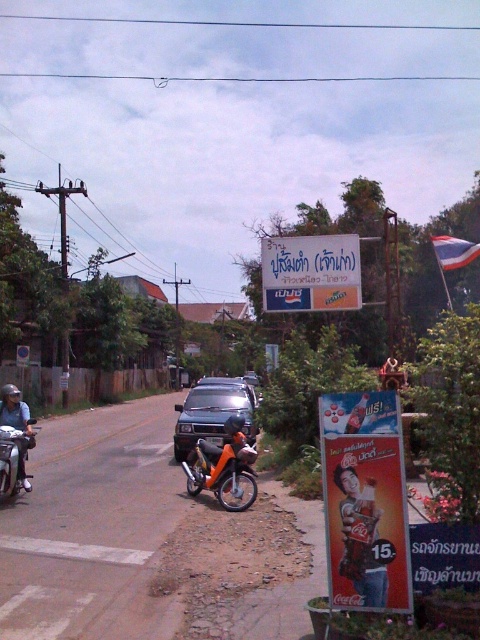
Between smooth plastic coca-cola sign at lower right and orange matte motorcycle at center, which one is positioned higher?

smooth plastic coca-cola sign at lower right is above.

Is smooth plastic coca-cola sign at lower right in front of orange matte motorcycle at center?

Yes, it is.

Who is more forward, (x=369, y=582) or (x=236, y=435)?

Point (x=369, y=582) is more forward.

Image resolution: width=480 pixels, height=640 pixels. I want to click on smooth plastic coca-cola sign at lower right, so pos(360,538).

Is smooth plastic coca-cola sign at lower right further to camera compared to matte black motorcycle at left?

That is False.

Is smooth plastic coca-cola sign at lower right taller than matte black motorcycle at left?

Indeed, smooth plastic coca-cola sign at lower right has a greater height compared to matte black motorcycle at left.

The image size is (480, 640). I want to click on smooth plastic coca-cola sign at lower right, so click(360, 538).

Locate an element on the screen. This screenshot has height=640, width=480. smooth plastic coca-cola sign at lower right is located at coordinates (360, 538).

Can you confirm if smooth plastic coca-cola sign at lower right is bigger than metallic gray car at center?

Actually, smooth plastic coca-cola sign at lower right might be smaller than metallic gray car at center.

Is smooth plastic coca-cola sign at lower right shorter than metallic gray car at center?

Yes, smooth plastic coca-cola sign at lower right is shorter than metallic gray car at center.

Is point (371, 566) farther from viewer compared to point (248, 419)?

No, it is not.

Locate an element on the screen. Image resolution: width=480 pixels, height=640 pixels. smooth plastic coca-cola sign at lower right is located at coordinates (360, 538).